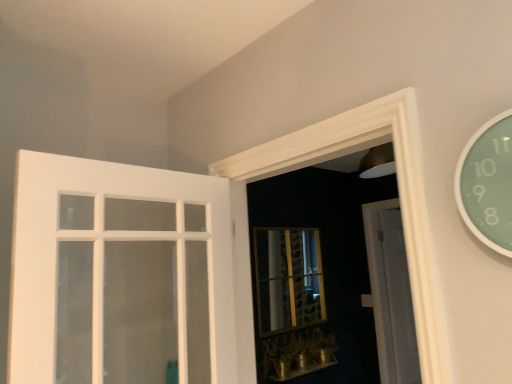
Question: Is white painted wood door at left, arranged as the 2th door when viewed from the right, aimed at metallic gold window sill at lower center?

Choices:
 (A) yes
 (B) no

Answer: (B)

Question: Is white painted wood door at left, arranged as the 2th door when viewed from the right, not inside metallic gold window sill at lower center?

Choices:
 (A) yes
 (B) no

Answer: (A)

Question: Is white painted wood door at left, arranged as the 1th door when viewed from the left, smaller than metallic gold window sill at lower center?

Choices:
 (A) no
 (B) yes

Answer: (A)

Question: Is white painted wood door at left, arranged as the 2th door when viewed from the right, directly adjacent to metallic gold window sill at lower center?

Choices:
 (A) yes
 (B) no

Answer: (B)

Question: Is white painted wood door at left, acting as the 1th door starting from the front, positioned with its back to metallic gold window sill at lower center?

Choices:
 (A) no
 (B) yes

Answer: (A)

Question: Looking at their shapes, would you say white painted wood door at left, acting as the 1th door starting from the front, is wider or thinner than gold textured glass bay window at center?

Choices:
 (A) wide
 (B) thin

Answer: (A)

Question: From the image's perspective, is white painted wood door at left, arranged as the 2th door when viewed from the right, positioned above or below gold textured glass bay window at center?

Choices:
 (A) above
 (B) below

Answer: (A)

Question: In terms of height, does white painted wood door at left, arranged as the 1th door when viewed from the left, look taller or shorter compared to gold textured glass bay window at center?

Choices:
 (A) tall
 (B) short

Answer: (A)

Question: Do you think white painted wood door at left, arranged as the 2th door when viewed from the right, is within gold textured glass bay window at center, or outside of it?

Choices:
 (A) inside
 (B) outside

Answer: (B)

Question: Looking at the image, does metallic gold window sill at lower center seem bigger or smaller compared to white painted wood door at left, acting as the 1th door starting from the front?

Choices:
 (A) small
 (B) big

Answer: (A)

Question: Based on their positions, is metallic gold window sill at lower center located to the left or right of white painted wood door at left, acting as the 1th door starting from the front?

Choices:
 (A) right
 (B) left

Answer: (A)

Question: In the image, is metallic gold window sill at lower center positioned in front of or behind white painted wood door at left, which ranks as the 2th door in back-to-front order?

Choices:
 (A) behind
 (B) front

Answer: (A)

Question: Looking at their shapes, would you say metallic gold window sill at lower center is wider or thinner than white painted wood door at left, acting as the 1th door starting from the front?

Choices:
 (A) wide
 (B) thin

Answer: (B)

Question: From a real-world perspective, is metallic gold window sill at lower center positioned above or below white wood door at center, which is the first door in back-to-front order?

Choices:
 (A) below
 (B) above

Answer: (A)

Question: In the image, is metallic gold window sill at lower center positioned in front of or behind white wood door at center, which is the first door in back-to-front order?

Choices:
 (A) behind
 (B) front

Answer: (B)